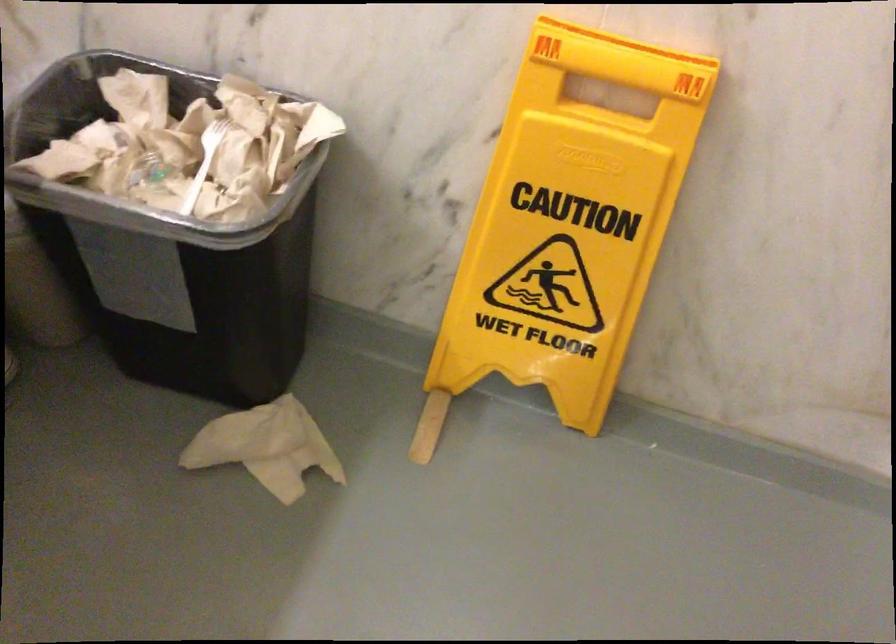
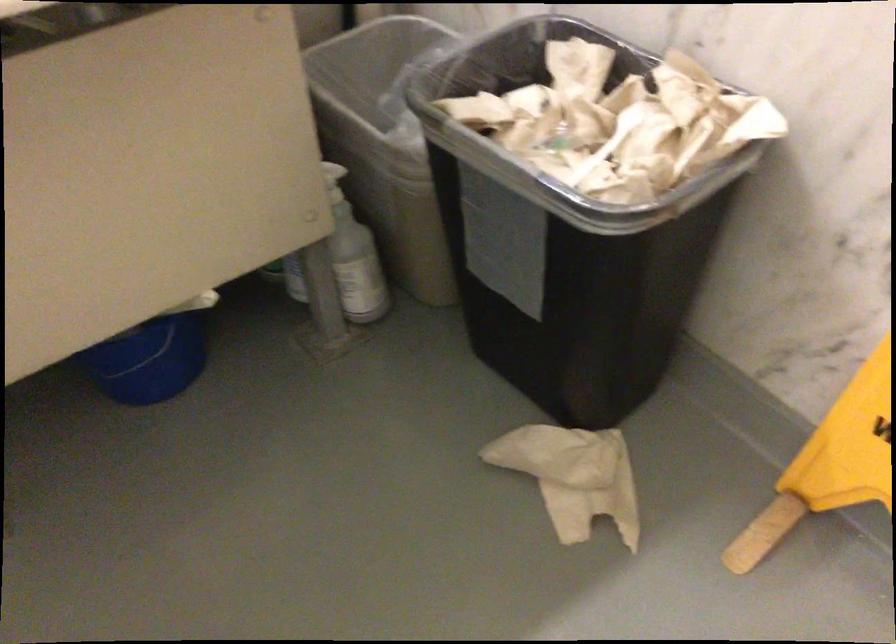
The point at (457, 359) is marked in the first image. Where is the corresponding point in the second image?

(830, 464)